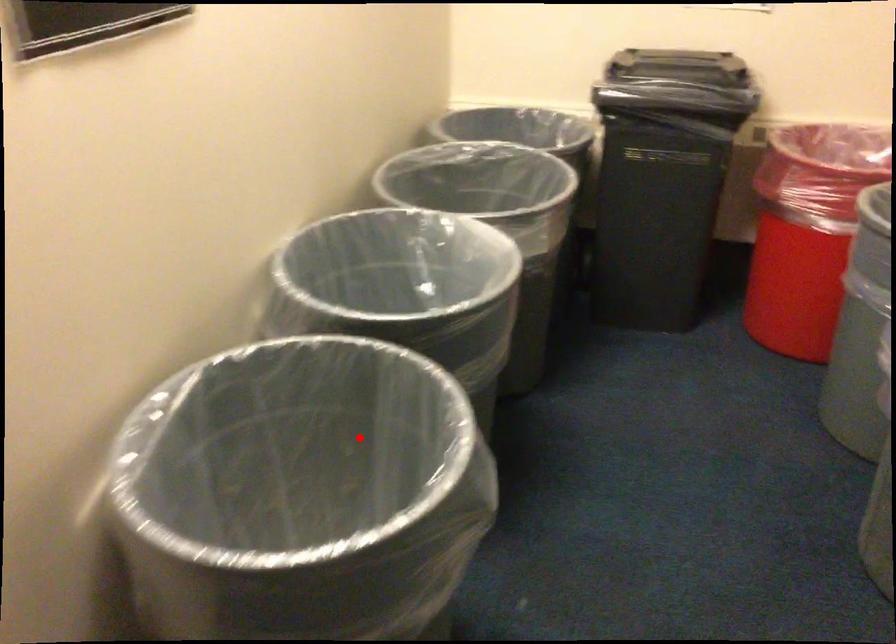
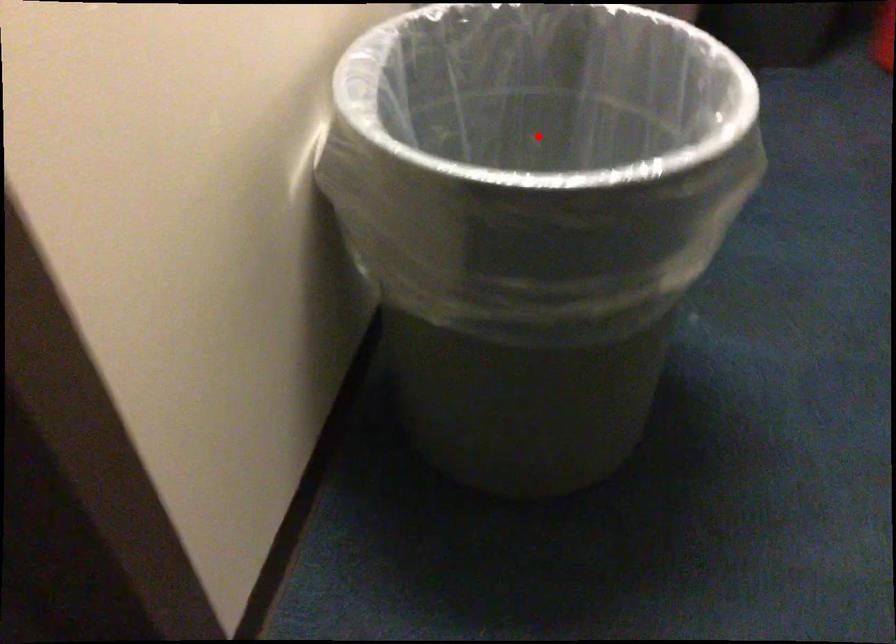
I am providing you with two images of the same scene from different viewpoints. A red point is marked on the first image and another point is marked on the second image. Are the points marked in image1 and image2 representing the same 3D position?

Yes